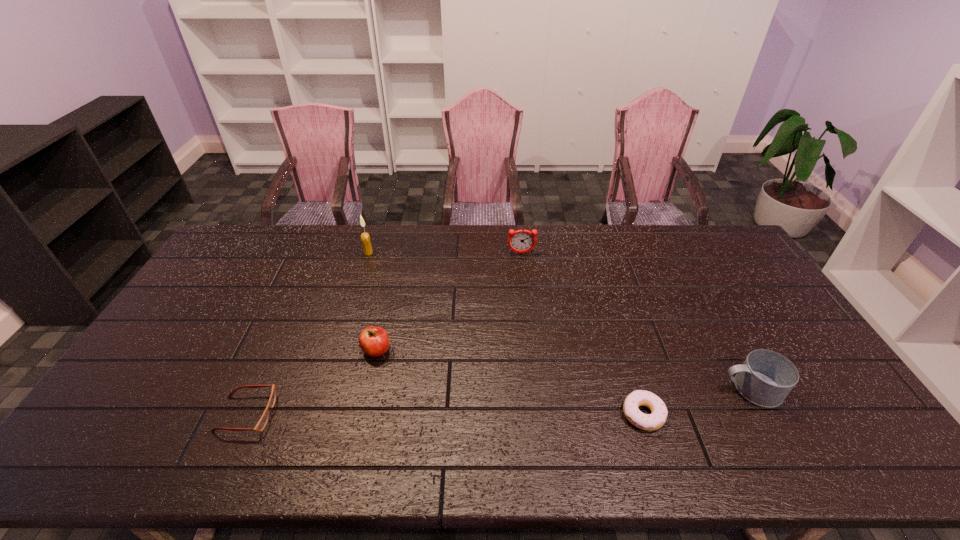
Find the location of a particular element. vacant area situated on the side of the mug with the handle is located at coordinates (633, 389).

At what (x,y) coordinates should I click in order to perform the action: click on free space located 0.210m on the side of the mug with the handle. Please return your answer as a coordinate pair (x, y). This screenshot has height=540, width=960. Looking at the image, I should click on (640, 389).

Find the location of `vacant point located 0.170m on the side of the mug with the handle`. vacant point located 0.170m on the side of the mug with the handle is located at coordinates (656, 389).

Where is `free location located 0.200m on the left of the fourth object from right to left`? Image resolution: width=960 pixels, height=540 pixels. free location located 0.200m on the left of the fourth object from right to left is located at coordinates (292, 350).

This screenshot has width=960, height=540. I want to click on vacant space located on the front-facing side of the spectacles, so click(380, 414).

You are a GUI agent. You are given a task and a screenshot of the screen. Output one action in this format:
    pyautogui.click(x=<x>, y=<y>)
    Task: Click on the vacant space situated 0.130m on the back of the second object from right to left
    Image resolution: width=960 pixels, height=540 pixels.
    Given the screenshot: What is the action you would take?
    pyautogui.click(x=625, y=356)

At what (x,y) coordinates should I click in order to perform the action: click on candle that is at the far edge. Please return your answer as a coordinate pair (x, y). The image size is (960, 540). Looking at the image, I should click on (365, 238).

Locate an element on the screen. The image size is (960, 540). alarm clock that is at the far edge is located at coordinates tap(521, 241).

Where is `spectacles present at the near edge`? Image resolution: width=960 pixels, height=540 pixels. spectacles present at the near edge is located at coordinates (261, 424).

Find the location of `doughnut located in the near edge section of the desktop`. doughnut located in the near edge section of the desktop is located at coordinates (649, 422).